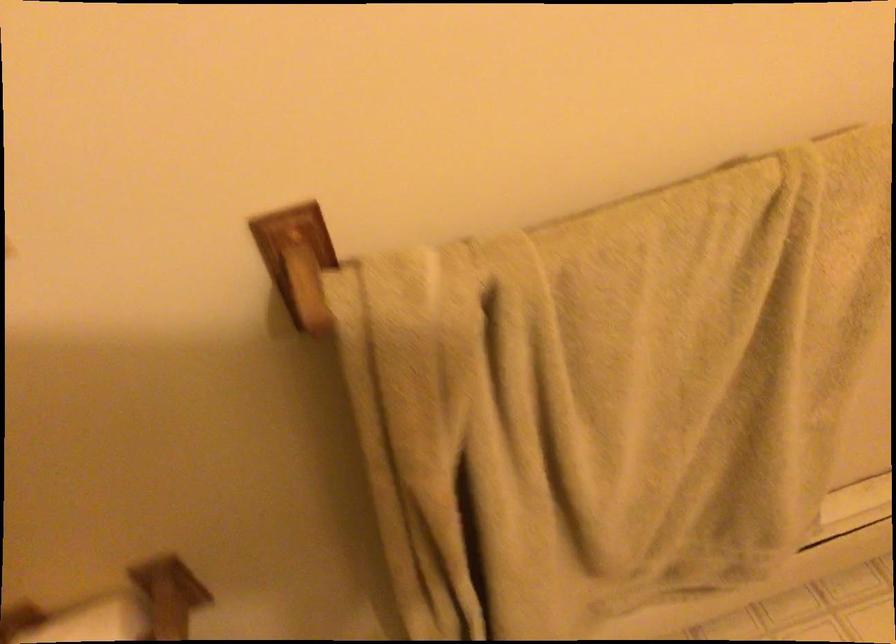
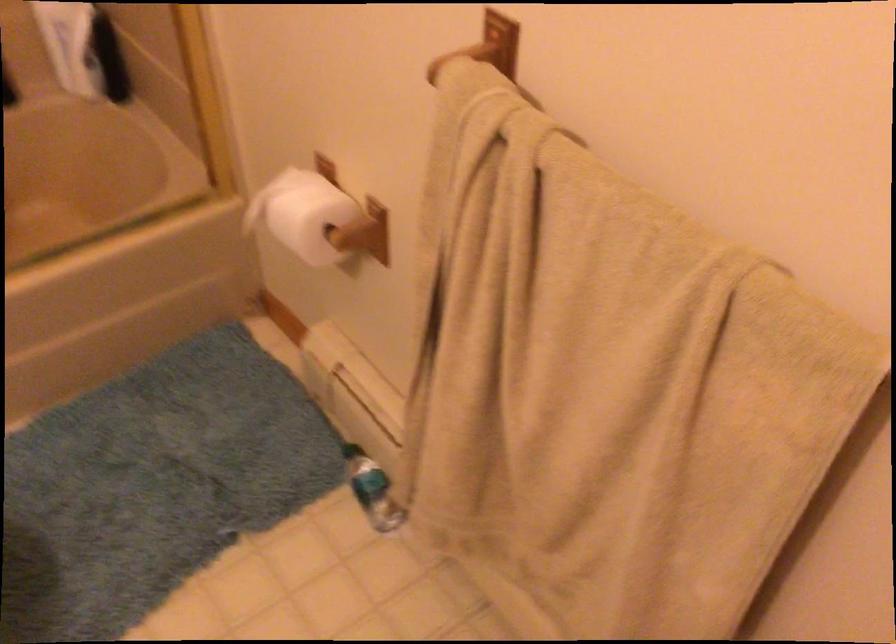
Based on the continuous images, in which direction is the camera rotating?

The camera's rotation is toward left-down.